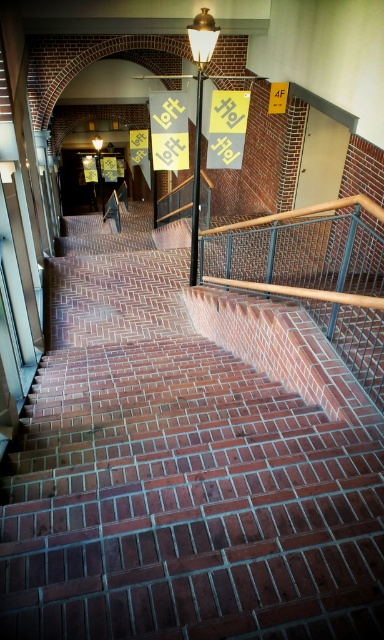
You are standing at the bottom of the brick stairs at center and want to see the yellow paper sign at center. Which object appears larger to you?

The yellow paper sign at center appears larger than the brick stairs at center because the brick stairs at center has a smaller size compared to yellow paper sign at center.